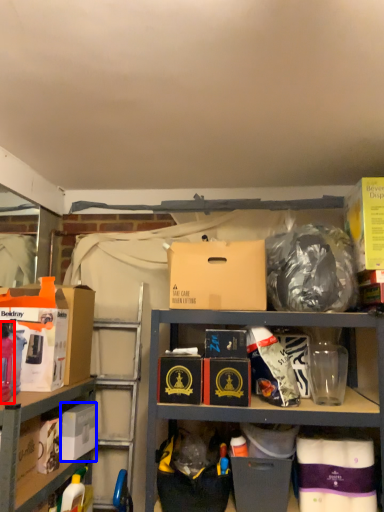
Question: Which object appears farthest to the camera in this image, bottle (highlighted by a red box) or box (highlighted by a blue box)?

Choices:
 (A) bottle
 (B) box

Answer: (B)